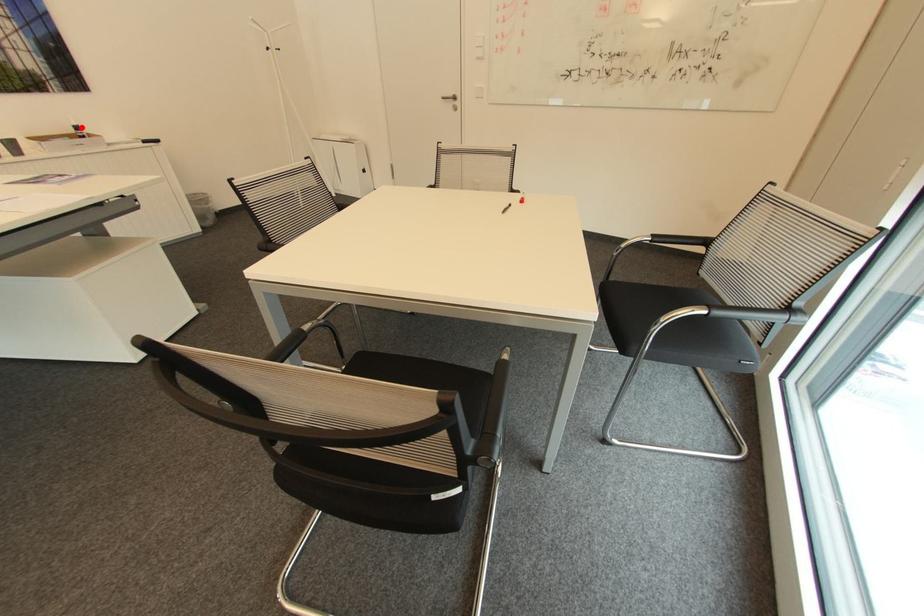
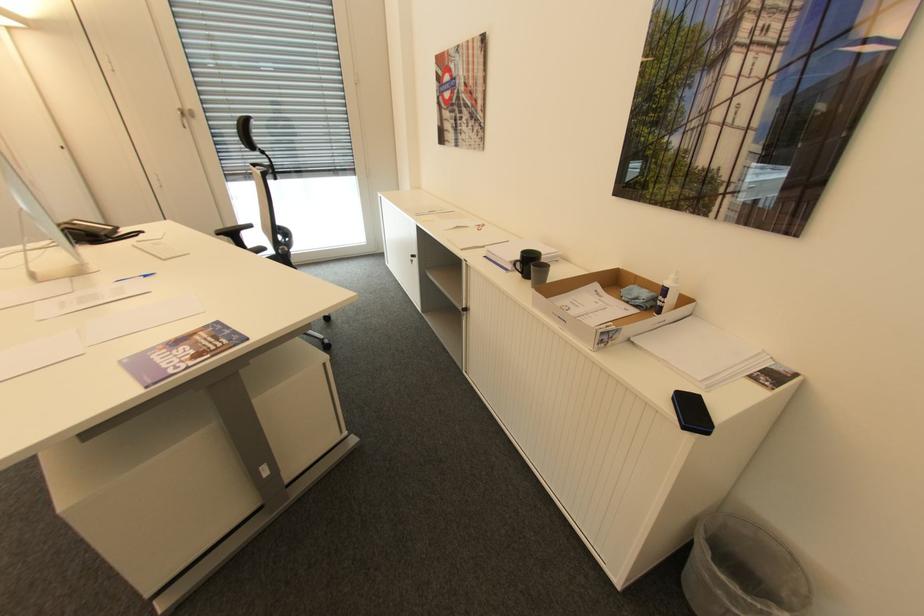
Where in the second image is the point corresponding to the highlighted location from the first image?

(670, 291)